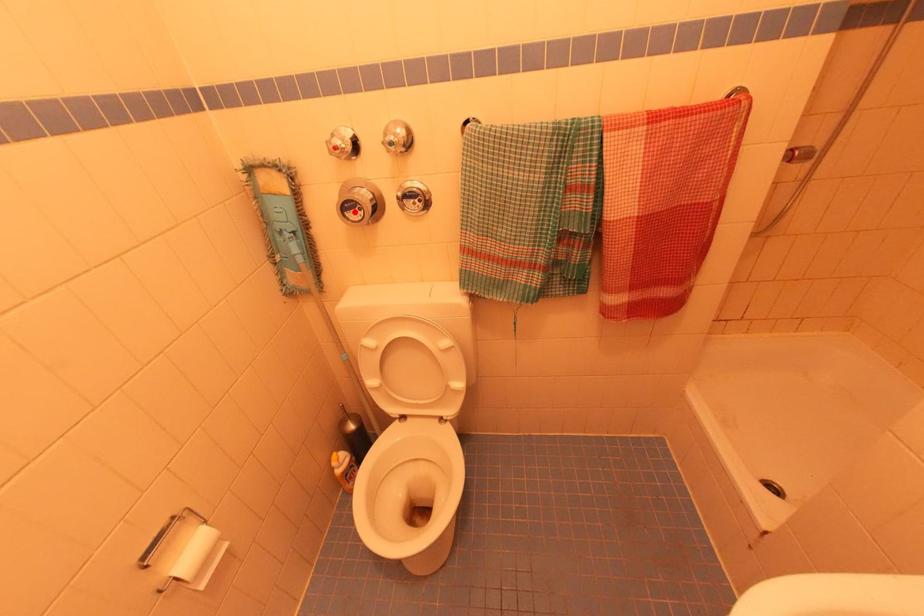
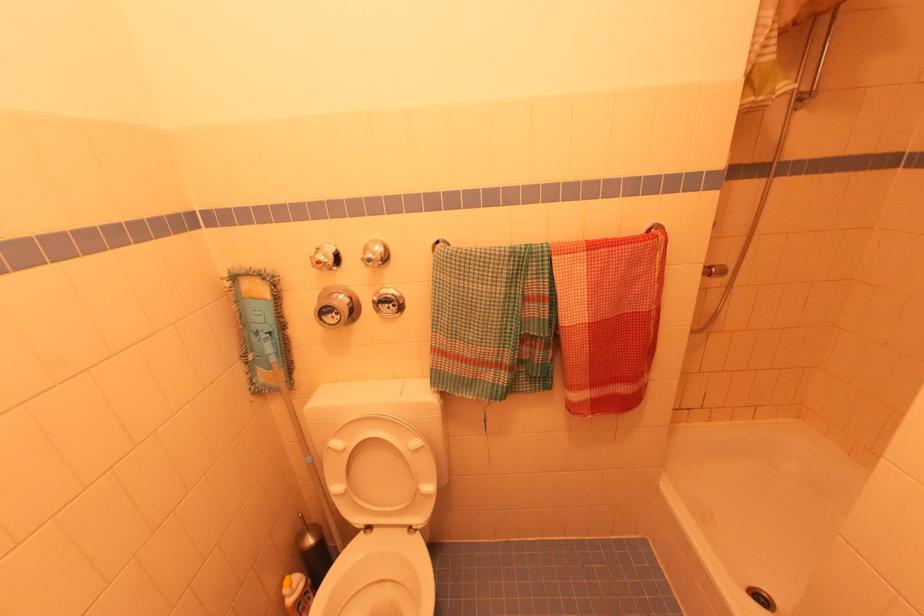
Where in the second image is the point corresponding to the highlighted location from the first image?

(332, 315)